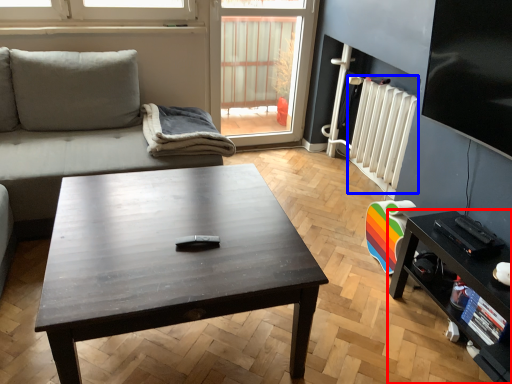
Question: Which object appears closest to the camera in this image, table (highlighted by a red box) or radiator (highlighted by a blue box)?

Choices:
 (A) table
 (B) radiator

Answer: (A)